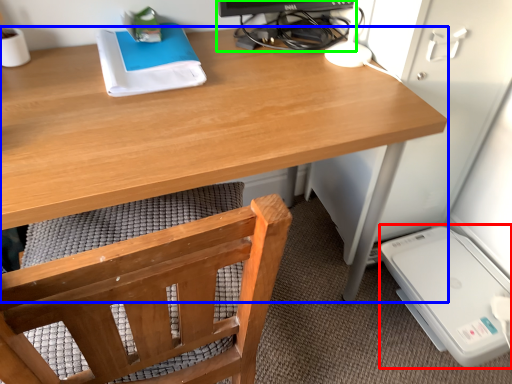
Question: Which object is positioned closest to appliance (highlighted by a red box)? Select from desk (highlighted by a blue box) and desktop computer (highlighted by a green box).

Choices:
 (A) desk
 (B) desktop computer

Answer: (A)